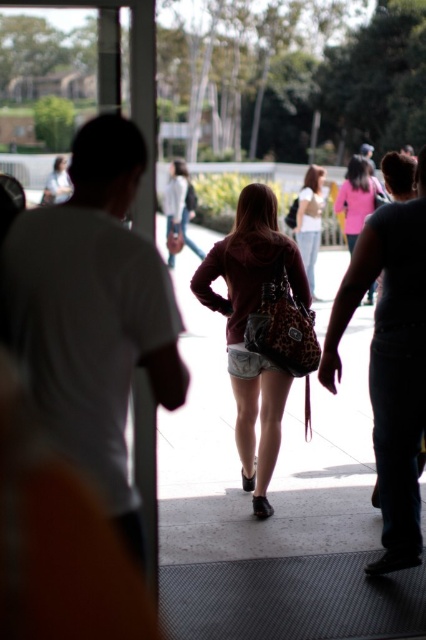
Question: Based on their relative distances, which object is farther from the leopard print bag at center?

Choices:
 (A) pink fabric jacket at upper center
 (B) matte gray pavement at center

Answer: (A)

Question: Which point is farther to the camera?

Choices:
 (A) pink fabric jacket at upper center
 (B) leopard print bag at center
 (C) matte gray pavement at center
 (D) white matte shirt at center

Answer: (A)

Question: Is matte gray pavement at center positioned before pink fabric jacket at upper center?

Choices:
 (A) no
 (B) yes

Answer: (B)

Question: Which object appears farthest from the camera in this image?

Choices:
 (A) white matte shirt at center
 (B) matte gray pavement at center

Answer: (A)

Question: Can you confirm if leopard print bag at center is bigger than white matte shirt at center?

Choices:
 (A) yes
 (B) no

Answer: (A)

Question: In this image, where is matte gray pavement at center located relative to white matte shirt at center?

Choices:
 (A) above
 (B) below

Answer: (B)